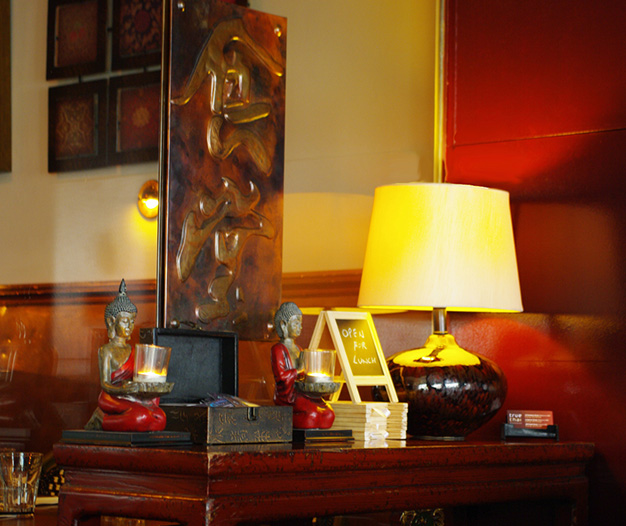
Find the location of a particular element. The width and height of the screenshot is (626, 526). lamp is located at coordinates (442, 369).